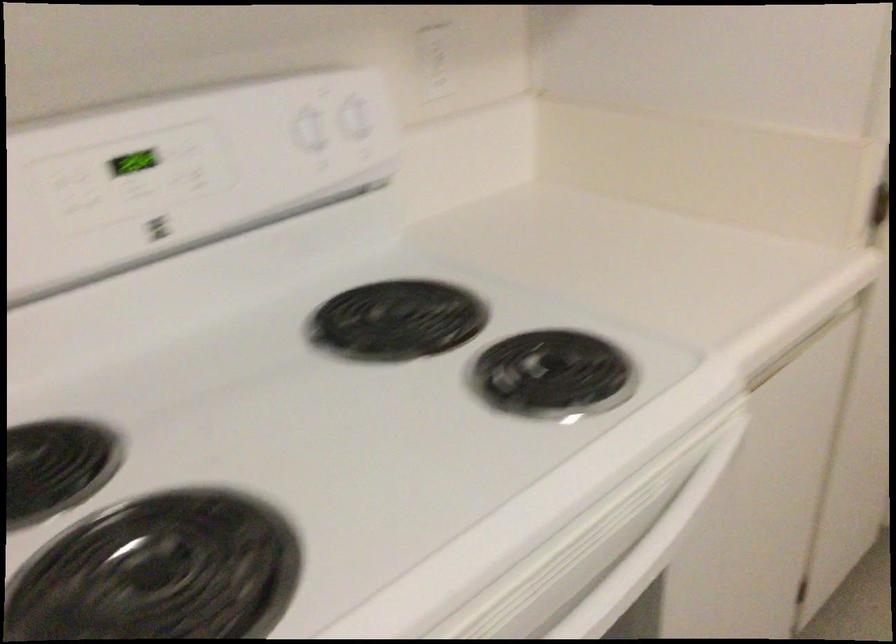
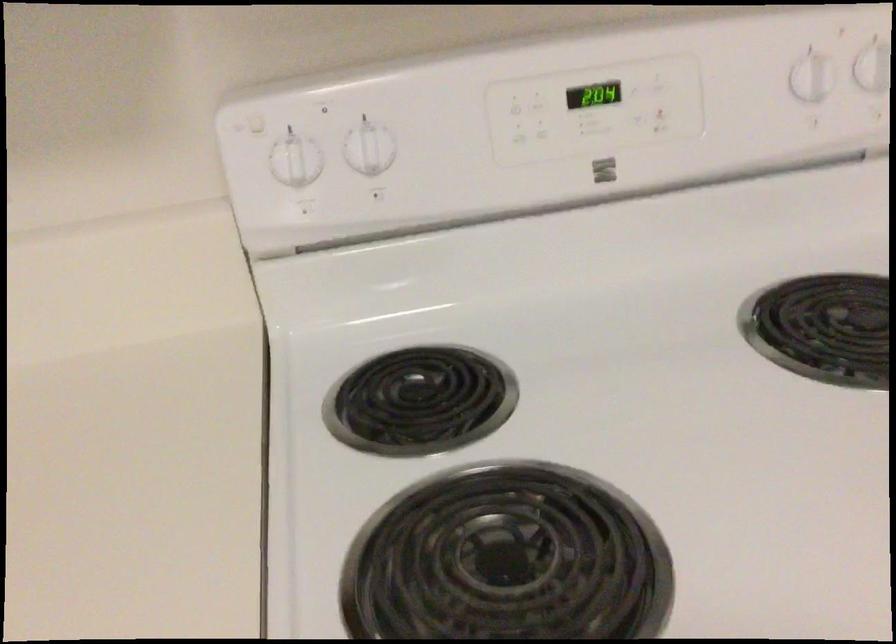
Find the pixel in the second image that matches [79,211] in the first image.

(521, 131)